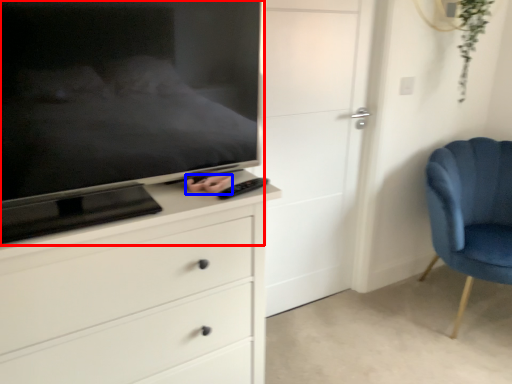
Question: Among these objects, which one is nearest to the camera, television (highlighted by a red box) or hand (highlighted by a blue box)?

Choices:
 (A) television
 (B) hand

Answer: (A)